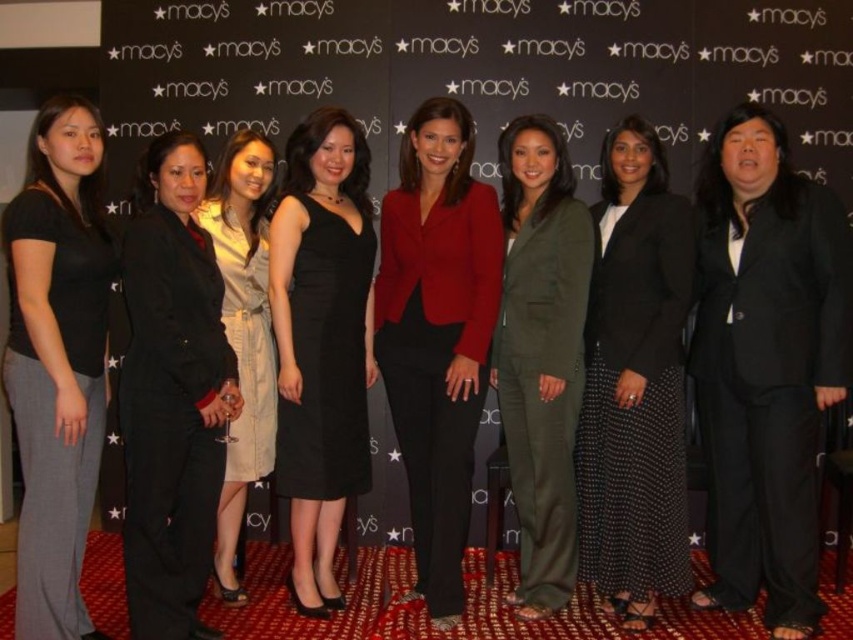
Measure the distance from matte red blazer at center to black satin dress at center.

matte red blazer at center is 11.73 inches from black satin dress at center.

Based on the photo, does matte red blazer at center have a lesser width compared to black satin dress at center?

In fact, matte red blazer at center might be wider than black satin dress at center.

The height and width of the screenshot is (640, 853). What do you see at coordinates (437, 362) in the screenshot?
I see `matte red blazer at center` at bounding box center [437, 362].

You are a GUI agent. You are given a task and a screenshot of the screen. Output one action in this format:
    pyautogui.click(x=<x>, y=<y>)
    Task: Click on the matte red blazer at center
    This screenshot has height=640, width=853.
    Given the screenshot: What is the action you would take?
    pyautogui.click(x=437, y=362)

Which is more to the right, black satin dress at center or light beige cotton dress at center?

black satin dress at center is more to the right.

Is point (345, 445) positioned after point (225, 576)?

No.

Is point (306, 304) behind point (257, 182)?

No, (306, 304) is in front of (257, 182).

The image size is (853, 640). What are the coordinates of `black satin dress at center` in the screenshot? It's located at (328, 362).

Does matte olive green suit at center appear over black satin dress at center?

Actually, matte olive green suit at center is below black satin dress at center.

Can you confirm if matte olive green suit at center is bigger than black satin dress at center?

Yes.

You are a GUI agent. You are given a task and a screenshot of the screen. Output one action in this format:
    pyautogui.click(x=<x>, y=<y>)
    Task: Click on the matte olive green suit at center
    
    Given the screenshot: What is the action you would take?
    pyautogui.click(x=541, y=353)